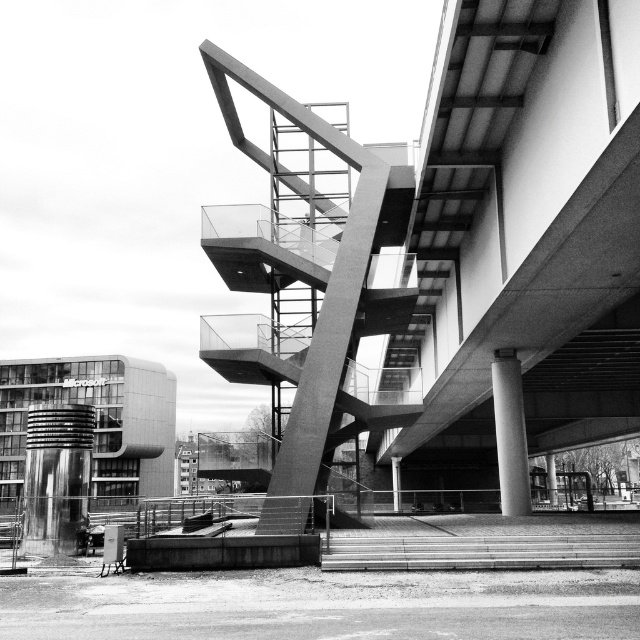
You are standing at the base of the concrete stairs at lower center and want to reach the smooth concrete pillar at center. Is the pillar below or above the stairs?

The concrete stairs at lower center is located above the smooth concrete pillar at center, so the pillar is below the stairs.

You are an architect reviewing this design. You need to place a safety barrier on the side of the concrete stairs at lower center that faces away from the smooth concrete pillar at center. Which direction should the barrier be placed?

The concrete stairs at lower center is to the left of the smooth concrete pillar at center, so the barrier should be placed on the right side of the concrete stairs at lower center to face away from the pillar.

You are standing at the base of the staircase in the image. There are two points marked in the scene. One is at coordinates point (160, 392) and the other is at point (550, 476). Which point is closer to you?

Point (160, 392) is closer to you because it is further to the viewer than point (550, 476).